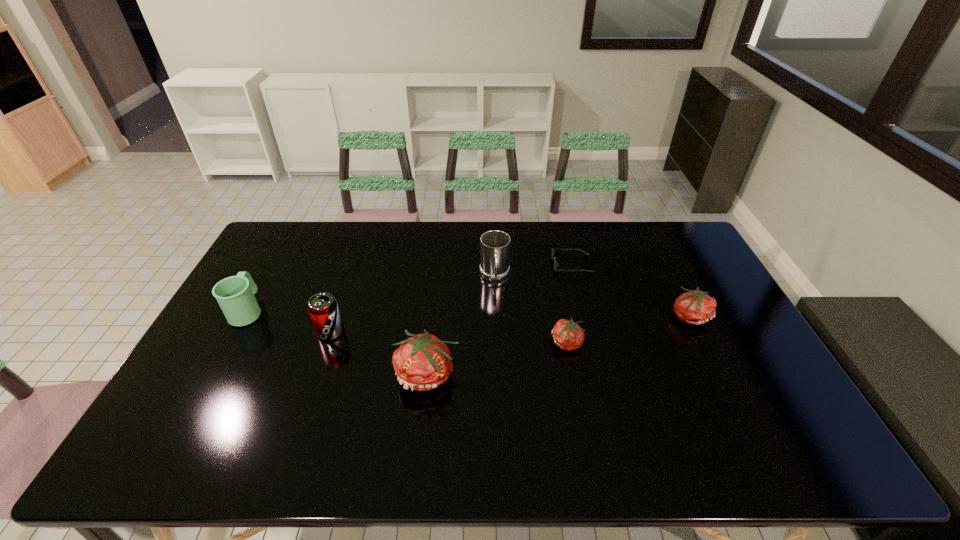
Please point a free position for a tomato on the left. Please provide its 2D coordinates. Your answer should be formatted as a tuple, i.e. [(x, y)], where the tuple contains the x and y coordinates of a point satisfying the conditions above.

[(266, 411)]